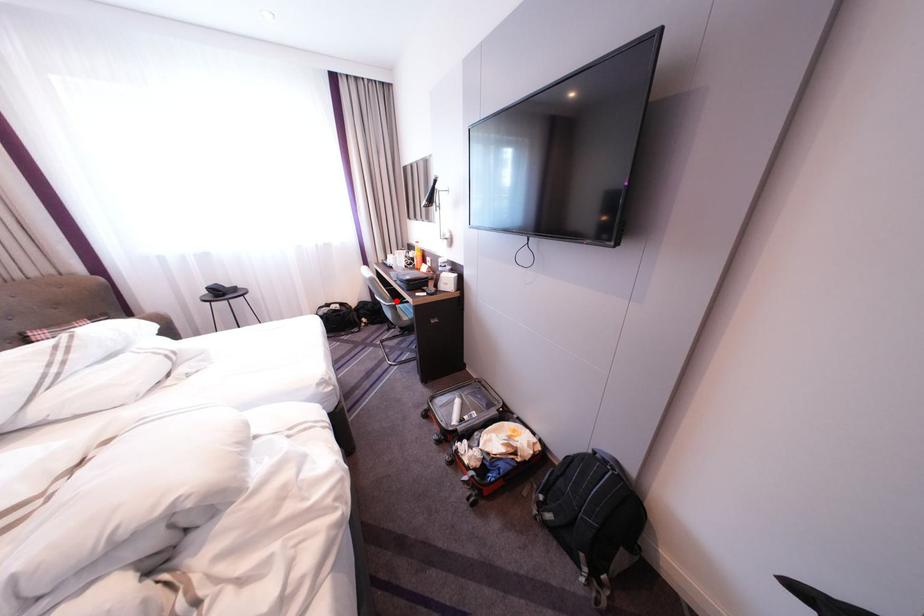
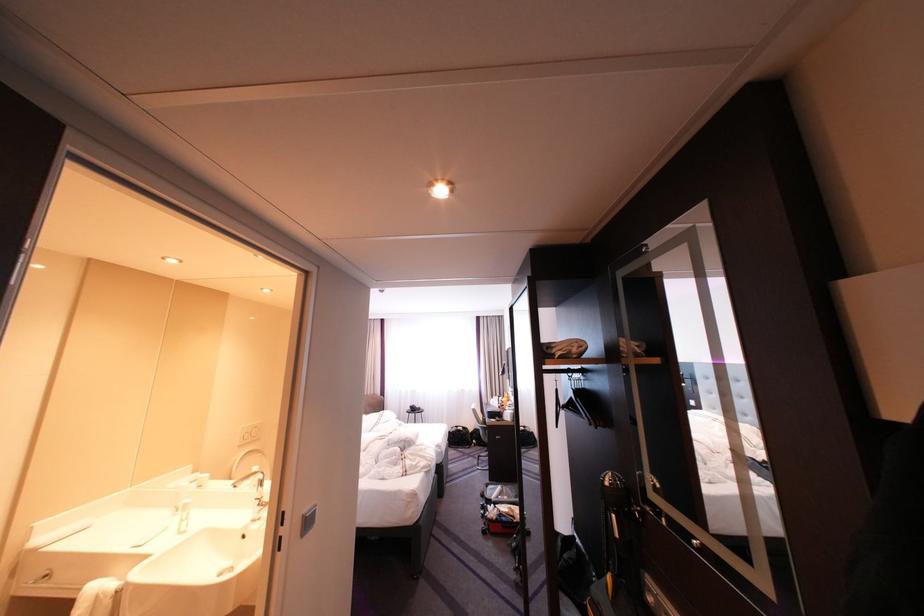
Locate, in the second image, the point that corresponds to the highlighted location in the first image.

(491, 424)